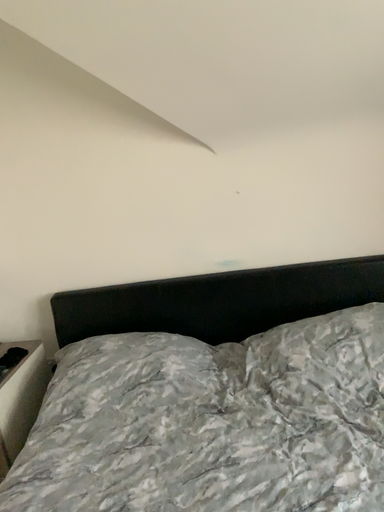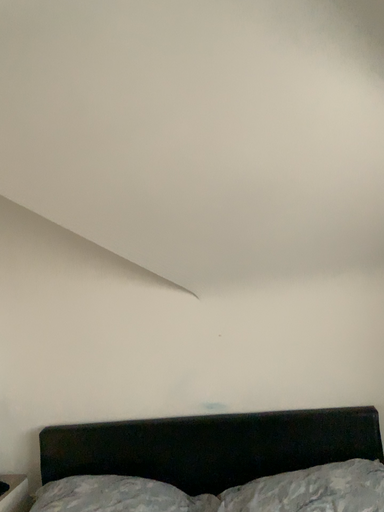
Question: Which way did the camera rotate in the video?

Choices:
 (A) rotated upward
 (B) rotated downward

Answer: (A)